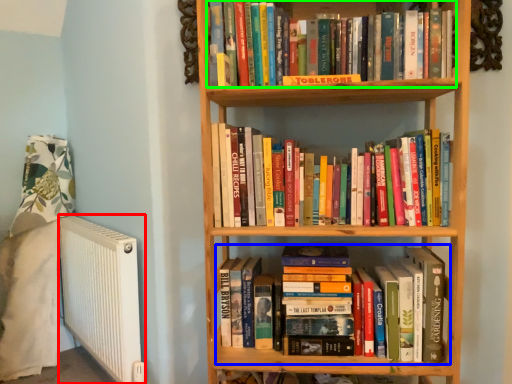
Question: Estimate the real-world distances between objects in this image. Which object is farther from radiator (highlighted by a red box), book (highlighted by a blue box) or book (highlighted by a green box)?

Choices:
 (A) book
 (B) book

Answer: (B)